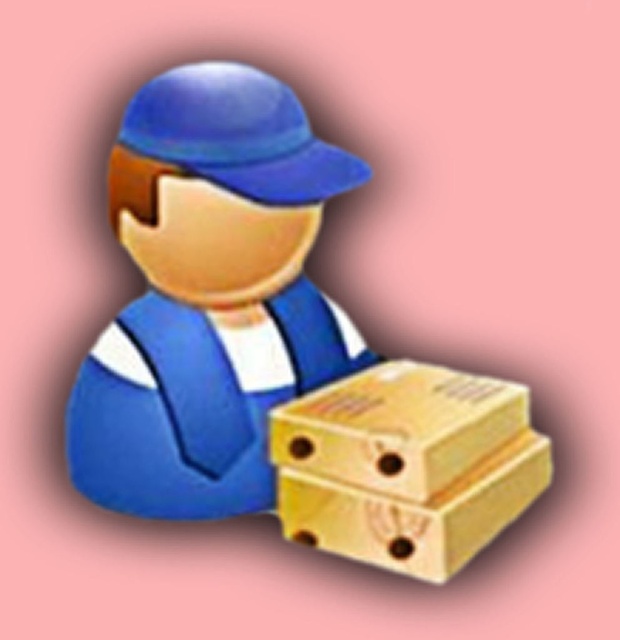
Can you confirm if matte blue uniform at center is wider than yellow cardboard box at lower right?

Yes, matte blue uniform at center is wider than yellow cardboard box at lower right.

Is point (277, 88) positioned behind point (425, 484)?

Yes, point (277, 88) is behind point (425, 484).

This screenshot has width=620, height=640. I want to click on matte blue uniform at center, so click(210, 296).

What do you see at coordinates (399, 428) in the screenshot? I see `yellow cardboard box at lower right` at bounding box center [399, 428].

Between yellow cardboard box at lower right and wooden box at center, which one has more height?

With more height is wooden box at center.

Where is `yellow cardboard box at lower right`? The image size is (620, 640). yellow cardboard box at lower right is located at coordinates (399, 428).

At what (x,y) coordinates should I click in order to perform the action: click on yellow cardboard box at lower right. Please return your answer as a coordinate pair (x, y). The width and height of the screenshot is (620, 640). Looking at the image, I should click on (399, 428).

Does point (215, 64) lie behind point (541, 467)?

No, (215, 64) is closer to viewer.

Which of these two, matte blue uniform at center or wooden box at center, stands shorter?

wooden box at center is shorter.

Who is more distant from viewer, (254, 484) or (316, 547)?

Point (254, 484)

The height and width of the screenshot is (640, 620). I want to click on matte blue uniform at center, so click(210, 296).